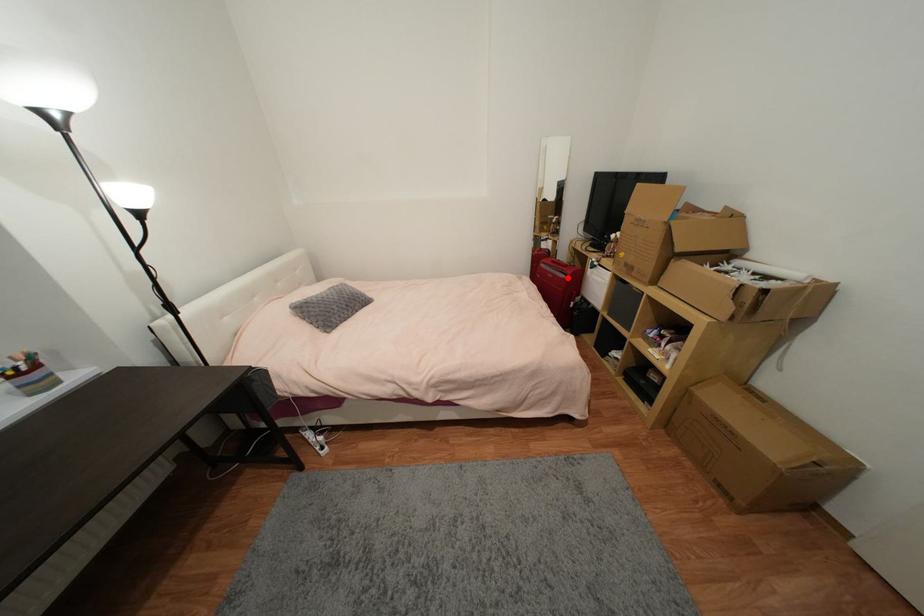
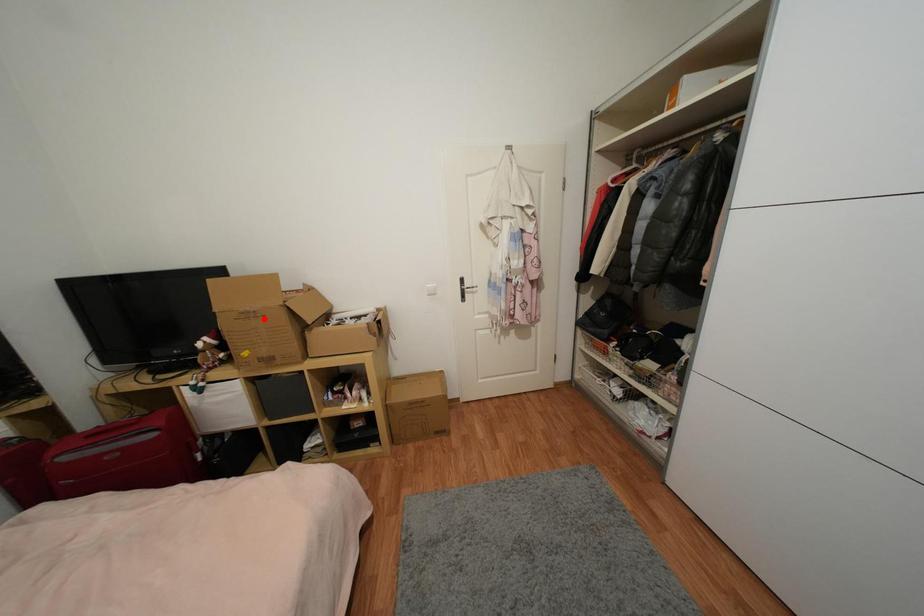
I am providing you with two images of the same scene from different viewpoints. A red point is marked on the first image and another point is marked on the second image. Is the marked point in image1 the same physical position as the marked point in image2?

No